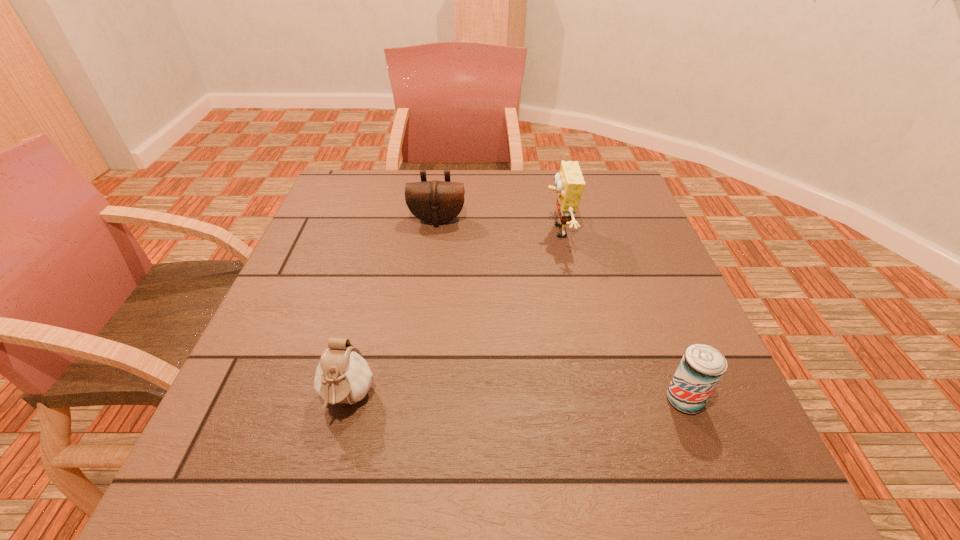
Find the location of a particular element. The width and height of the screenshot is (960, 540). free space between the beer can and the farther pouch is located at coordinates tap(561, 310).

The width and height of the screenshot is (960, 540). What are the coordinates of `free space between the farther pouch and the beer can` in the screenshot? It's located at (561, 310).

Where is `free space between the nearer pouch and the beer can`? free space between the nearer pouch and the beer can is located at coordinates (516, 400).

The image size is (960, 540). I want to click on free point between the tallest object and the rightmost object, so click(x=621, y=316).

The height and width of the screenshot is (540, 960). I want to click on vacant point located between the third object from left to right and the beer can, so click(621, 316).

The width and height of the screenshot is (960, 540). Identify the location of vacant area that lies between the farther pouch and the rightmost object. (561, 310).

Identify the location of vacant area that lies between the tallest object and the farther pouch. The height and width of the screenshot is (540, 960). (497, 226).

Find the location of a particular element. free space between the third object from left to right and the farther pouch is located at coordinates point(497,226).

At what (x,y) coordinates should I click in order to perform the action: click on free space that is in between the farther pouch and the nearer pouch. Please return your answer as a coordinate pair (x, y). This screenshot has width=960, height=540. Looking at the image, I should click on (393, 310).

In order to click on free point between the beer can and the farther pouch in this screenshot , I will do `click(561, 310)`.